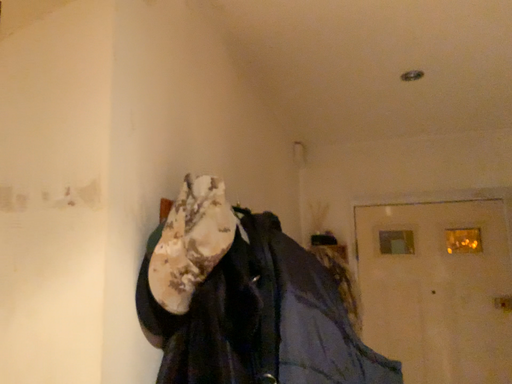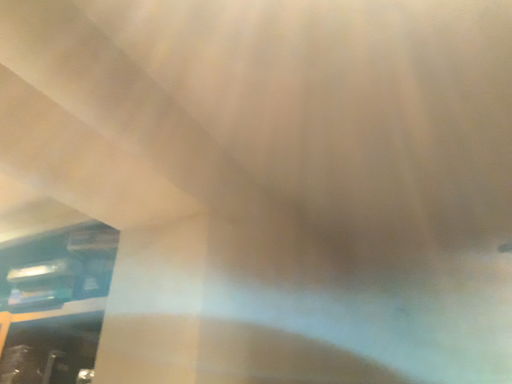
Question: How did the camera likely rotate when shooting the video?

Choices:
 (A) rotated upward
 (B) rotated downward

Answer: (A)